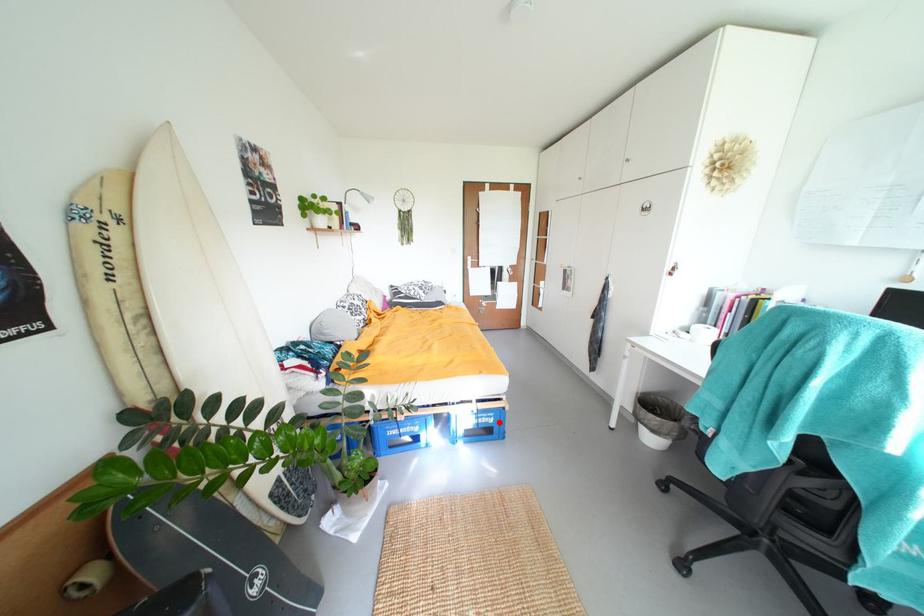
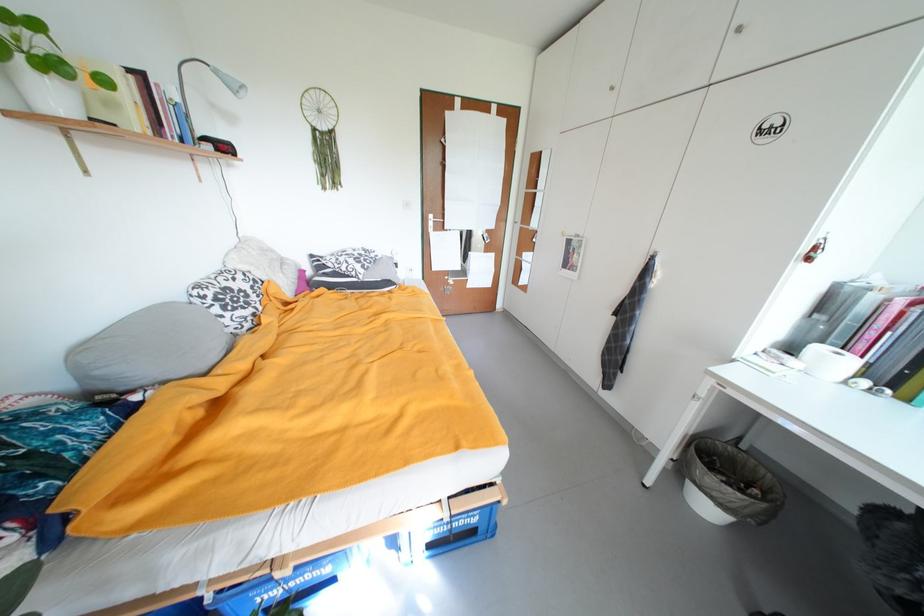
Where in the second image is the point corresponding to the highlighted location from the first image?

(482, 522)